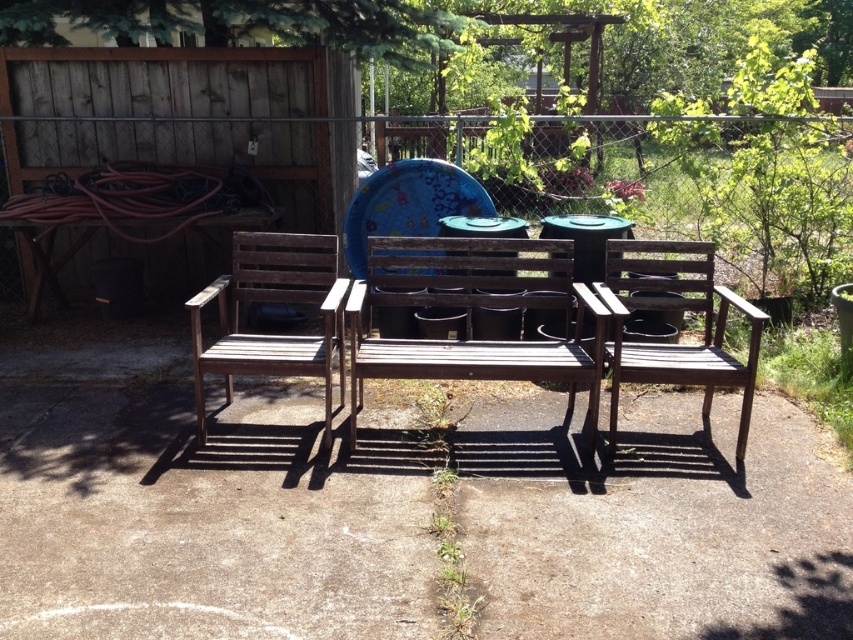
You are standing at the point marked by the coordinates point (471,316) in the image. Based on the scene description, what object are you currently standing on?

The point (471,316) is on the wooden bench at center, so you are standing on the wooden bench at center.

From the picture: You are sitting on the wooden bench at center and want to reach the dark brown wood chair at center. Which object is shorter so you can easily step onto it?

The wooden bench at center is shorter than the dark brown wood chair at center, so you can easily step onto it.

You are standing in front of the wooden benches and want to take a photo that includes both point (332, 292) and point (711, 244). Which point should be closer to the camera to ensure both are in focus?

Point (332, 292) is closer to the camera than point (711, 244), so you should position the camera so that point (332, 292) is closer to ensure both are in focus.